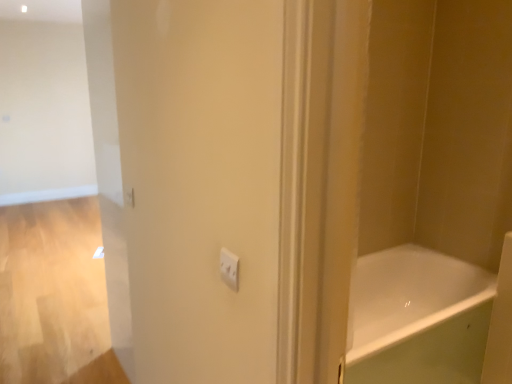
What do you see at coordinates (418, 318) in the screenshot? The image size is (512, 384). I see `white glossy bathtub at center` at bounding box center [418, 318].

Identify the location of white glossy bathtub at center. The width and height of the screenshot is (512, 384). (418, 318).

Image resolution: width=512 pixels, height=384 pixels. Identify the location of white plastic light switch at center. (x=229, y=268).

What do you see at coordinates (229, 268) in the screenshot? This screenshot has width=512, height=384. I see `white plastic light switch at center` at bounding box center [229, 268].

Where is `white glossy bathtub at center`? white glossy bathtub at center is located at coordinates (418, 318).

Considering the relative positions of white plastic light switch at center and white glossy bathtub at center in the image provided, is white plastic light switch at center to the left of white glossy bathtub at center from the viewer's perspective?

Correct, you'll find white plastic light switch at center to the left of white glossy bathtub at center.

Is white plastic light switch at center positioned before white glossy bathtub at center?

Yes, white plastic light switch at center is closer to the camera.

Does point (221, 273) appear closer or farther from the camera than point (394, 300)?

Point (221, 273) is closer to the camera than point (394, 300).

From the image's perspective, would you say white plastic light switch at center is positioned over white glossy bathtub at center?

Correct, white plastic light switch at center appears higher than white glossy bathtub at center in the image.

From a real-world perspective, which object rests below the other?

white glossy bathtub at center, from a real-world perspective.

Which object is thinner, white plastic light switch at center or white glossy bathtub at center?

Thinner between the two is white plastic light switch at center.

Who is shorter, white plastic light switch at center or white glossy bathtub at center?

white plastic light switch at center.

Based on their sizes in the image, would you say white plastic light switch at center is bigger or smaller than white glossy bathtub at center?

Clearly, white plastic light switch at center is smaller in size than white glossy bathtub at center.

Is white plastic light switch at center surrounding white glossy bathtub at center?

No, white glossy bathtub at center is not surrounded by white plastic light switch at center.

Is white plastic light switch at center next to white glossy bathtub at center?

white plastic light switch at center and white glossy bathtub at center are not in contact.

Is white plastic light switch at center facing away from white glossy bathtub at center?

That's not correct — white plastic light switch at center is not looking away from white glossy bathtub at center.

Measure the distance between white plastic light switch at center and white glossy bathtub at center.

white plastic light switch at center and white glossy bathtub at center are 5.17 feet apart.

The width and height of the screenshot is (512, 384). Find the location of `light switch located above the white glossy bathtub at center (from a real-world perspective)`. light switch located above the white glossy bathtub at center (from a real-world perspective) is located at coordinates (229, 268).

Is white glossy bathtub at center to the right of white plastic light switch at center from the viewer's perspective?

Yes, white glossy bathtub at center is to the right of white plastic light switch at center.

Is the position of white glossy bathtub at center more distant than that of white plastic light switch at center?

Yes, white glossy bathtub at center is further from the viewer.

Between point (393, 340) and point (227, 280), which one is positioned behind?

The point (393, 340) is more distant.

From the image's perspective, does white glossy bathtub at center appear lower than white plastic light switch at center?

Yes, from the image's perspective, white glossy bathtub at center is below white plastic light switch at center.

From a real-world perspective, does white glossy bathtub at center sit lower than white plastic light switch at center?

Correct, in the physical world, white glossy bathtub at center is lower than white plastic light switch at center.

Considering the relative sizes of white glossy bathtub at center and white plastic light switch at center in the image provided, is white glossy bathtub at center thinner than white plastic light switch at center?

Incorrect, the width of white glossy bathtub at center is not less than that of white plastic light switch at center.

Who is shorter, white glossy bathtub at center or white plastic light switch at center?

Standing shorter between the two is white plastic light switch at center.

Does white glossy bathtub at center have a smaller size compared to white plastic light switch at center?

Incorrect, white glossy bathtub at center is not smaller in size than white plastic light switch at center.

Is white glossy bathtub at center positioned beyond the bounds of white plastic light switch at center?

Yes, white glossy bathtub at center is not within white plastic light switch at center.

Is white glossy bathtub at center not near white plastic light switch at center?

white glossy bathtub at center is positioned a significant distance from white plastic light switch at center.

Is white glossy bathtub at center facing towards white plastic light switch at center?

No, white glossy bathtub at center is not turned towards white plastic light switch at center.

What's the angular difference between white glossy bathtub at center and white plastic light switch at center's facing directions?

white glossy bathtub at center and white plastic light switch at center are facing 88.7 degrees away from each other.

Image resolution: width=512 pixels, height=384 pixels. Find the location of `light switch located above the white glossy bathtub at center (from a real-world perspective)`. light switch located above the white glossy bathtub at center (from a real-world perspective) is located at coordinates (229, 268).

Identify the location of bathtub that is under the white plastic light switch at center (from a real-world perspective). The image size is (512, 384). (418, 318).

You are a GUI agent. You are given a task and a screenshot of the screen. Output one action in this format:
    pyautogui.click(x=<x>, y=<y>)
    Task: Click on the light switch that is on the left side of white glossy bathtub at center
    Image resolution: width=512 pixels, height=384 pixels.
    Given the screenshot: What is the action you would take?
    pyautogui.click(x=229, y=268)